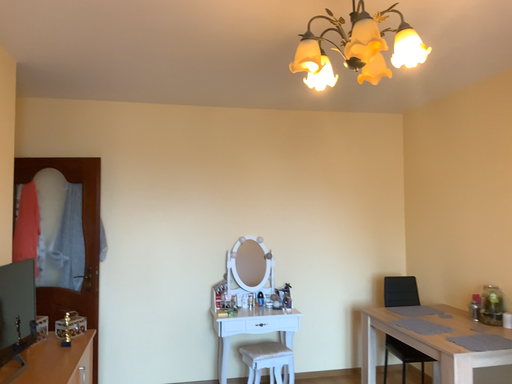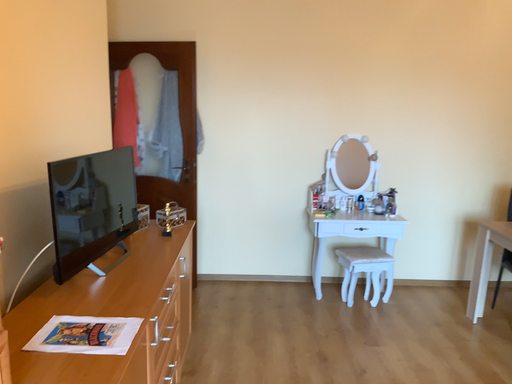
Question: How did the camera likely rotate when shooting the video?

Choices:
 (A) rotated left
 (B) rotated right

Answer: (A)